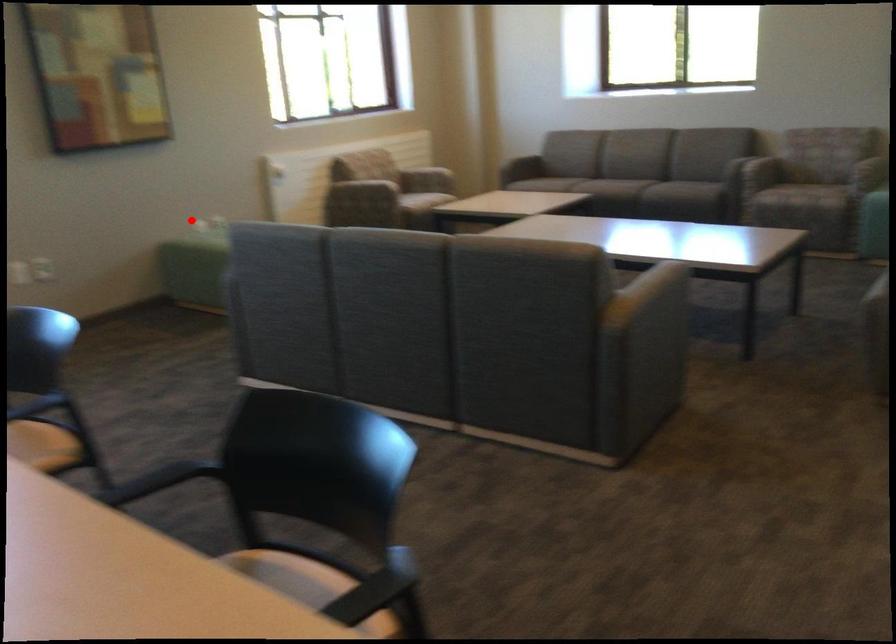
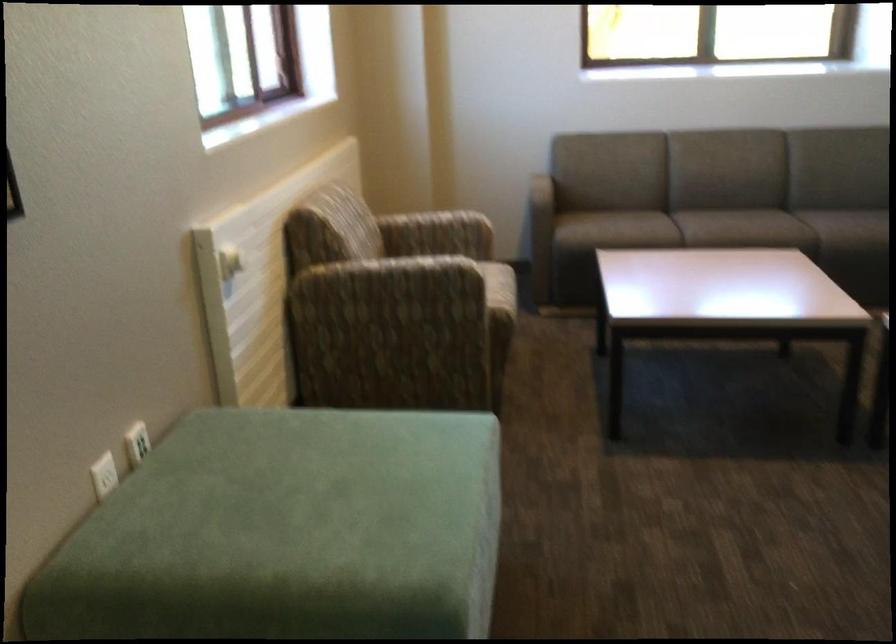
Question: I am providing you with two images of the same scene from different viewpoints. A red point is marked on the first image. Can you still see the location of the red point in image 2?

Choices:
 (A) Yes
 (B) No

Answer: (A)